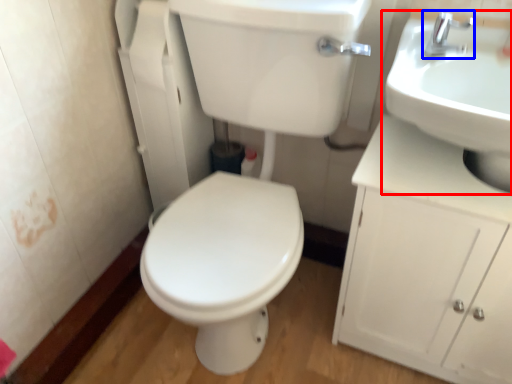
Question: Which point is further to the camera, sink (highlighted by a red box) or tap (highlighted by a blue box)?

Choices:
 (A) sink
 (B) tap

Answer: (B)